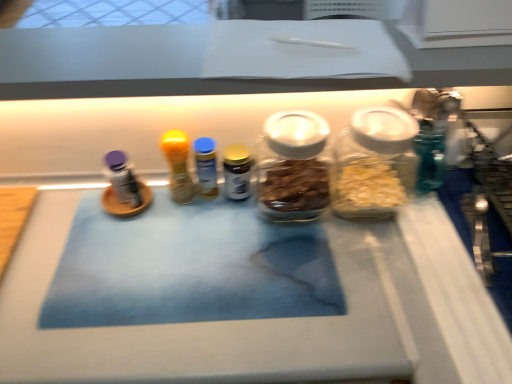
Image resolution: width=512 pixels, height=384 pixels. Describe the element at coordinates (178, 166) in the screenshot. I see `yellow matte bottle at center, the fifth bottle positioned from the right` at that location.

Find the location of a particular element. The image size is (512, 384). blue plastic bottle at center, the second bottle viewed from the left is located at coordinates (206, 166).

Where is `transparent glass jar at center, which appears as the 2th bottle when viewed from the right`? The width and height of the screenshot is (512, 384). transparent glass jar at center, which appears as the 2th bottle when viewed from the right is located at coordinates (293, 167).

Describe the element at coordinates (374, 163) in the screenshot. I see `translucent glass jar at right, marked as the fifth bottle in a left-to-right arrangement` at that location.

Identify the location of translucent glass jar at right, the 1th bottle when ordered from right to left. The image size is (512, 384). (374, 163).

This screenshot has height=384, width=512. In order to click on blue marble table at center in this screenshot , I will do `click(279, 318)`.

I want to click on yellow matte bottle at center, the fifth bottle positioned from the right, so click(178, 166).

Based on the photo, how different are the orientations of transparent glass jar at center, the 4th bottle when ordered from left to right, and blue plastic bottle at center, the second bottle viewed from the left, in degrees?

The angle between the facing direction of transparent glass jar at center, the 4th bottle when ordered from left to right, and the facing direction of blue plastic bottle at center, the second bottle viewed from the left, is 0.00152 degrees.

From a real-world perspective, is transparent glass jar at center, which appears as the 2th bottle when viewed from the right, located higher than blue plastic bottle at center, which is the fourth bottle from right to left?

Yes, from a real-world perspective, transparent glass jar at center, which appears as the 2th bottle when viewed from the right, is over blue plastic bottle at center, which is the fourth bottle from right to left

Is transparent glass jar at center, the 4th bottle when ordered from left to right, thinner than blue plastic bottle at center, the second bottle viewed from the left?

Incorrect, the width of transparent glass jar at center, the 4th bottle when ordered from left to right, is not less than that of blue plastic bottle at center, the second bottle viewed from the left.

Is transparent glass jar at center, which appears as the 2th bottle when viewed from the right, to the left of blue plastic bottle at center, the second bottle viewed from the left, from the viewer's perspective?

In fact, transparent glass jar at center, which appears as the 2th bottle when viewed from the right, is to the right of blue plastic bottle at center, the second bottle viewed from the left.

Where is `table that appears on the left of blue plastic bottle at center, the second bottle viewed from the left`? table that appears on the left of blue plastic bottle at center, the second bottle viewed from the left is located at coordinates (279, 318).

Which object is wider, blue plastic bottle at center, which is the fourth bottle from right to left, or blue marble table at center?

blue marble table at center.

Consider the image. Is blue plastic bottle at center, the second bottle viewed from the left, situated inside blue marble table at center or outside?

blue plastic bottle at center, the second bottle viewed from the left, is not inside blue marble table at center, it's outside.

From a real-world perspective, who is located higher, blue plastic bottle at center, the second bottle viewed from the left, or blue marble table at center?

blue plastic bottle at center, the second bottle viewed from the left, is physically above.

Considering the relative sizes of yellow matte bottle at center, the fifth bottle positioned from the right, and translucent glass jar at right, marked as the fifth bottle in a left-to-right arrangement, in the image provided, is yellow matte bottle at center, the fifth bottle positioned from the right, taller than translucent glass jar at right, marked as the fifth bottle in a left-to-right arrangement,?

No, yellow matte bottle at center, the fifth bottle positioned from the right, is not taller than translucent glass jar at right, marked as the fifth bottle in a left-to-right arrangement.

Does yellow matte bottle at center, the fifth bottle positioned from the right, have a greater width compared to translucent glass jar at right, the 1th bottle when ordered from right to left?

No, yellow matte bottle at center, the fifth bottle positioned from the right, is not wider than translucent glass jar at right, the 1th bottle when ordered from right to left.

Is yellow matte bottle at center, the fifth bottle positioned from the right, facing away from translucent glass jar at right, the 1th bottle when ordered from right to left?

That's not correct — yellow matte bottle at center, the fifth bottle positioned from the right, is not looking away from translucent glass jar at right, the 1th bottle when ordered from right to left.

From a real-world perspective, starting from the yellow matte bottle at center, marked as the 1th bottle in a left-to-right arrangement, which bottle is the 1st one below it? Please provide its 2D coordinates.

[(206, 166)]

Which object is thinner, blue plastic bottle at center, which is the fourth bottle from right to left, or yellow matte bottle at center, marked as the 1th bottle in a left-to-right arrangement?

blue plastic bottle at center, which is the fourth bottle from right to left.

Who is taller, blue plastic bottle at center, which is the fourth bottle from right to left, or yellow matte bottle at center, the fifth bottle positioned from the right?

With more height is yellow matte bottle at center, the fifth bottle positioned from the right.

Which of these two, gold metallic spice jar at center, the third bottle from the left, or blue plastic bottle at center, which is the fourth bottle from right to left, stands taller?

blue plastic bottle at center, which is the fourth bottle from right to left.

Looking at the image, does gold metallic spice jar at center, which is counted as the third bottle, starting from the right, seem bigger or smaller compared to blue plastic bottle at center, the second bottle viewed from the left?

Considering their sizes, gold metallic spice jar at center, which is counted as the third bottle, starting from the right, takes up less space than blue plastic bottle at center, the second bottle viewed from the left.

Is gold metallic spice jar at center, the third bottle from the left, beside blue plastic bottle at center, which is the fourth bottle from right to left?

Yes, gold metallic spice jar at center, the third bottle from the left, and blue plastic bottle at center, which is the fourth bottle from right to left, clearly make contact.

Considering the relative positions of gold metallic spice jar at center, the third bottle from the left, and blue marble table at center in the image provided, is gold metallic spice jar at center, the third bottle from the left, in front of blue marble table at center?

No, the depth of gold metallic spice jar at center, the third bottle from the left, is greater than that of blue marble table at center.

Could you tell me if gold metallic spice jar at center, the third bottle from the left, is turned towards blue marble table at center?

No, gold metallic spice jar at center, the third bottle from the left, is not oriented towards blue marble table at center.

How far apart are gold metallic spice jar at center, which is counted as the third bottle, starting from the right, and blue marble table at center?

They are 12.35 inches apart.

Between gold metallic spice jar at center, which is counted as the third bottle, starting from the right, and blue marble table at center, which one has smaller width?

gold metallic spice jar at center, which is counted as the third bottle, starting from the right, is thinner.

Does blue marble table at center have a greater width compared to translucent glass jar at right, marked as the fifth bottle in a left-to-right arrangement?

Yes, blue marble table at center is wider than translucent glass jar at right, marked as the fifth bottle in a left-to-right arrangement.

Could you tell me if blue marble table at center is turned towards translucent glass jar at right, marked as the fifth bottle in a left-to-right arrangement?

No.

Is blue marble table at center in front of or behind translucent glass jar at right, marked as the fifth bottle in a left-to-right arrangement, in the image?

Clearly, blue marble table at center is in front of translucent glass jar at right, marked as the fifth bottle in a left-to-right arrangement.

Is blue marble table at center next to translucent glass jar at right, marked as the fifth bottle in a left-to-right arrangement?

blue marble table at center and translucent glass jar at right, marked as the fifth bottle in a left-to-right arrangement, are not in contact.

This screenshot has width=512, height=384. I want to click on bottle that is the 2nd object above the blue plastic bottle at center, the second bottle viewed from the left (from a real-world perspective), so click(293, 167).

Locate an element on the screen. This screenshot has width=512, height=384. table below the blue plastic bottle at center, the second bottle viewed from the left (from the image's perspective) is located at coordinates (279, 318).

From the image, which object appears to be nearer to translucent glass jar at right, the 1th bottle when ordered from right to left, gold metallic spice jar at center, which is counted as the third bottle, starting from the right, or blue plastic bottle at center, the second bottle viewed from the left?

Among the two, gold metallic spice jar at center, which is counted as the third bottle, starting from the right, is located nearer to translucent glass jar at right, the 1th bottle when ordered from right to left.

When comparing their distances from transparent glass jar at center, the 4th bottle when ordered from left to right, does gold metallic spice jar at center, which is counted as the third bottle, starting from the right, or translucent glass jar at right, the 1th bottle when ordered from right to left, seem closer?

gold metallic spice jar at center, which is counted as the third bottle, starting from the right.

Which object lies nearer to the anchor point translucent glass jar at right, the 1th bottle when ordered from right to left, gold metallic spice jar at center, the third bottle from the left, or blue marble table at center?

Among the two, blue marble table at center is located nearer to translucent glass jar at right, the 1th bottle when ordered from right to left.

From the image, which object appears to be farther from yellow matte bottle at center, marked as the 1th bottle in a left-to-right arrangement, transparent glass jar at center, which appears as the 2th bottle when viewed from the right, or blue marble table at center?

The object further to yellow matte bottle at center, marked as the 1th bottle in a left-to-right arrangement, is blue marble table at center.

Looking at the image, which one is located closer to gold metallic spice jar at center, which is counted as the third bottle, starting from the right, yellow matte bottle at center, the fifth bottle positioned from the right, or blue marble table at center?

Based on the image, yellow matte bottle at center, the fifth bottle positioned from the right, appears to be nearer to gold metallic spice jar at center, which is counted as the third bottle, starting from the right.

Based on their spatial positions, is blue plastic bottle at center, the second bottle viewed from the left, or transparent glass jar at center, the 4th bottle when ordered from left to right, closer to translucent glass jar at right, the 1th bottle when ordered from right to left?

Among the two, transparent glass jar at center, the 4th bottle when ordered from left to right, is located nearer to translucent glass jar at right, the 1th bottle when ordered from right to left.

When comparing their distances from transparent glass jar at center, which appears as the 2th bottle when viewed from the right, does blue marble table at center or translucent glass jar at right, the 1th bottle when ordered from right to left, seem further?

blue marble table at center is positioned further to the anchor transparent glass jar at center, which appears as the 2th bottle when viewed from the right.

Looking at the image, which one is located further to blue marble table at center, blue plastic bottle at center, which is the fourth bottle from right to left, or yellow matte bottle at center, the fifth bottle positioned from the right?

blue plastic bottle at center, which is the fourth bottle from right to left, is positioned further to the anchor blue marble table at center.

This screenshot has width=512, height=384. I want to click on bottle situated between gold metallic spice jar at center, which is counted as the third bottle, starting from the right, and translucent glass jar at right, marked as the fifth bottle in a left-to-right arrangement, from left to right, so click(x=293, y=167).

Identify the location of bottle between blue plastic bottle at center, the second bottle viewed from the left, and transparent glass jar at center, which appears as the 2th bottle when viewed from the right, in the horizontal direction. (237, 172).

Where is `bottle between yellow matte bottle at center, the fifth bottle positioned from the right, and gold metallic spice jar at center, the third bottle from the left`? This screenshot has width=512, height=384. bottle between yellow matte bottle at center, the fifth bottle positioned from the right, and gold metallic spice jar at center, the third bottle from the left is located at coordinates point(206,166).

You are a GUI agent. You are given a task and a screenshot of the screen. Output one action in this format:
    pyautogui.click(x=<x>, y=<y>)
    Task: Click on the bottle between transparent glass jar at center, which appears as the 2th bottle when viewed from the right, and blue marble table at center from top to bottom
    
    Given the screenshot: What is the action you would take?
    pyautogui.click(x=237, y=172)